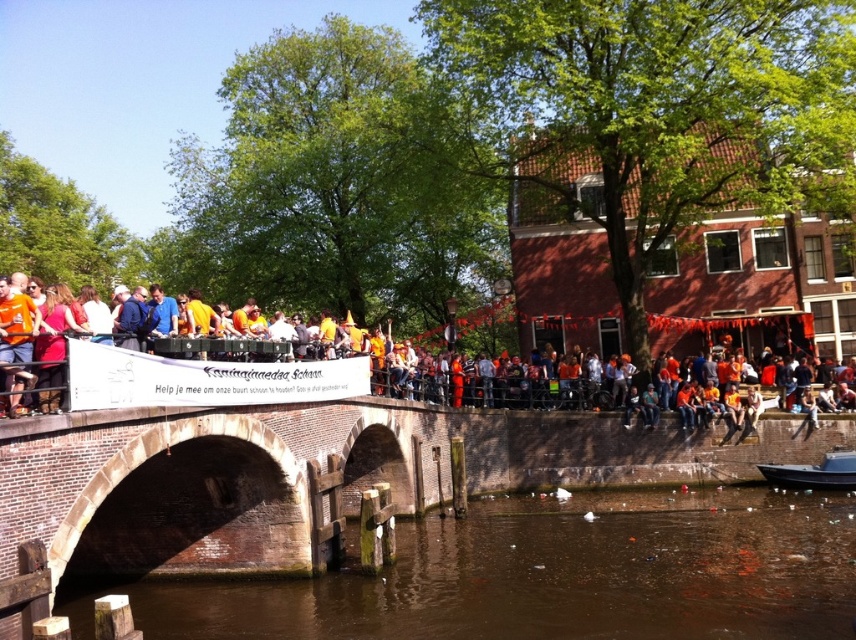
You are a visitor at the canal and see the brown murky water at lower center and the black glossy boat at lower right. Which object is located below the other?

The brown murky water at lower center is positioned under black glossy boat at lower right.

You are a photographer standing on the stone bridge and want to capture the entire orange fabric banner at center and the brown murky water at lower center in one shot. Which object will take up more area in the photo?

The orange fabric banner at center takes up more area in the photo because it occupies more space than the brown murky water at lower center according to the description.

You are a photographer standing on the stone bridge. You want to capture a photo that includes both the orange fabric banner at center and the black glossy boat at lower right. Which object should you position closer to the edge of the frame to ensure both fit in the shot?

Since the orange fabric banner at center is wider than the black glossy boat at lower right, you should position the orange fabric banner at center closer to the edge of the frame to ensure both fit in the shot.